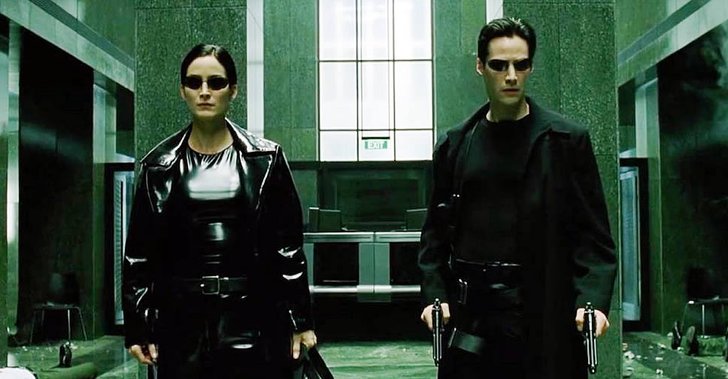
Locate an element on the screen. black chairs is located at coordinates (712, 291), (65, 294).